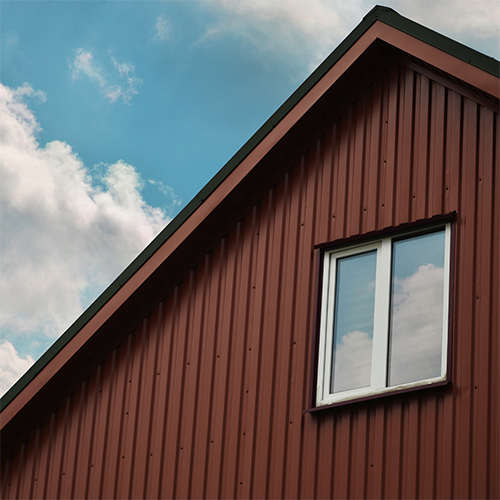
Where is `blinds`? blinds is located at coordinates (431, 338).